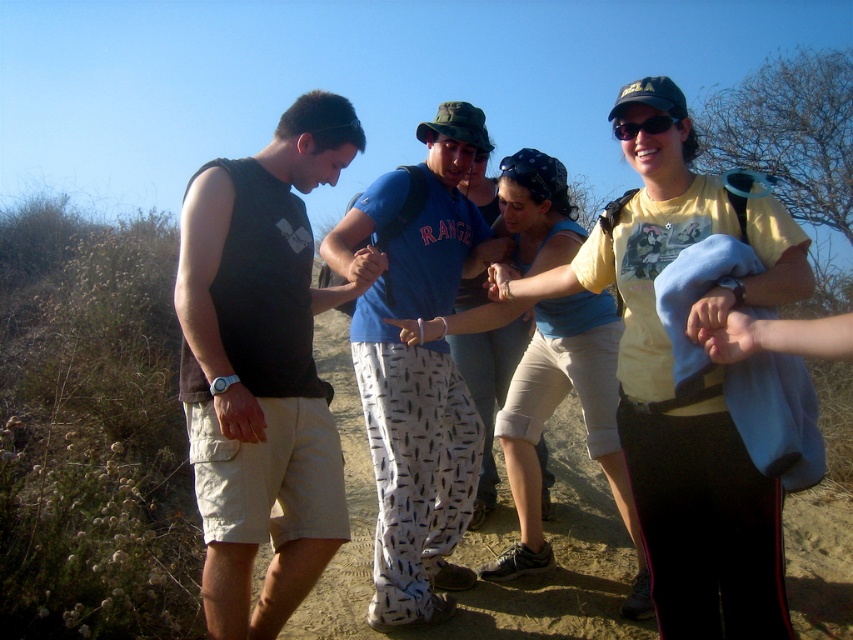
Question: Which point is closer to the camera?

Choices:
 (A) blue cotton tank top at center
 (B) yellow cotton t-shirt at center
 (C) matte black tank top at left
 (D) black plastic sunglasses at upper center

Answer: (B)

Question: Can you confirm if blue cotton shirt at center is positioned above blue cotton tank top at center?

Choices:
 (A) yes
 (B) no

Answer: (A)

Question: Which point appears farthest from the camera in this image?

Choices:
 (A) (373, 387)
 (B) (616, 138)
 (C) (335, 467)
 (D) (711, 424)

Answer: (B)

Question: Observing the image, what is the correct spatial positioning of matte black tank top at left in reference to yellow cotton t-shirt at center?

Choices:
 (A) right
 (B) left

Answer: (B)

Question: Is yellow cotton t-shirt at center wider than black plastic sunglasses at upper center?

Choices:
 (A) yes
 (B) no

Answer: (A)

Question: Which point is closer to the camera?

Choices:
 (A) (578, 282)
 (B) (370, 392)
 (C) (252, 508)
 (D) (635, 128)

Answer: (D)